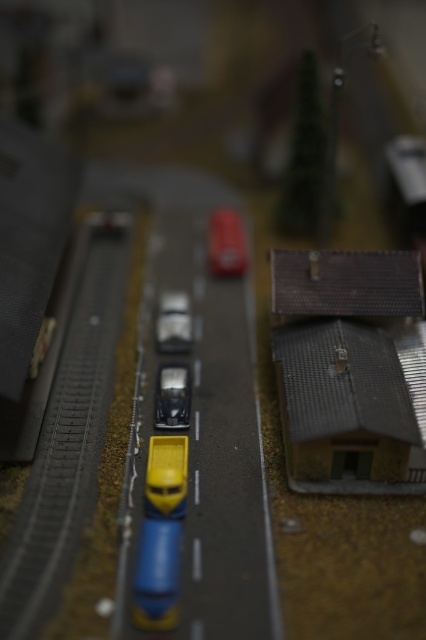
You are a toy car collector examining the diorama. You notice the yellow matte truck at center and the matte silver car at center. Which vehicle is positioned closer to the front of the scene?

The yellow matte truck at center is closer to the viewer than the matte silver car at center, so it is positioned closer to the front of the scene.

You are a toy car collector examining the diorama. You need to determine if the brown textured roof at right can fit on a display shelf that is the same width as the yellow matte truck at center. Can it fit?

The brown textured roof at right is wider than the yellow matte truck at center, so it cannot fit on a display shelf with the same width as the yellow matte truck at center.

Looking at this image, you are standing in front of the miniature road scene. You notice two points marked in the image. The first point is at coordinates point (69, 506), and the second is at point (247, 259). Which point is closer to you?

Point (69, 506) is closer to the viewer than point (247, 259).